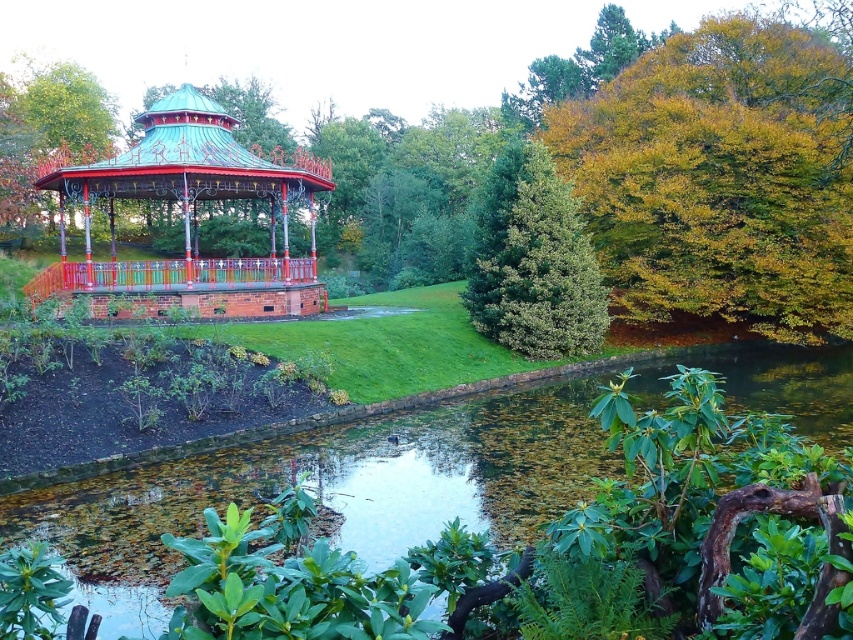
Question: Which of these objects is positioned farthest from the yellow-green leaves at upper right?

Choices:
 (A) green leafy tree at center
 (B) metallic copper gazebo at upper left
 (C) green leafy water at center
 (D) green textured tree at center

Answer: (B)

Question: Is green leafy tree at center smaller than yellow-green leaves at upper right?

Choices:
 (A) no
 (B) yes

Answer: (A)

Question: Which point is closer to the camera taking this photo?

Choices:
 (A) (80, 284)
 (B) (650, 253)

Answer: (A)

Question: Is green textured tree at center above green leafy water at center?

Choices:
 (A) yes
 (B) no

Answer: (A)

Question: Is metallic copper gazebo at upper left smaller than green leafy water at center?

Choices:
 (A) no
 (B) yes

Answer: (A)

Question: Which point is farther to the camera?

Choices:
 (A) (283, 218)
 (B) (524, 323)

Answer: (A)